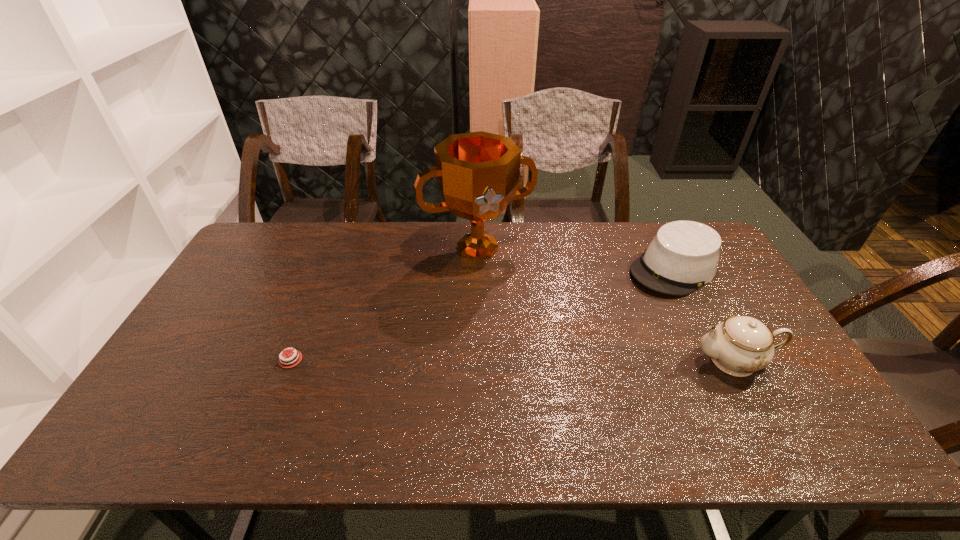
Image resolution: width=960 pixels, height=540 pixels. In order to click on free location that satisfies the following two spatial constraints: 1. on the front side of the award; 2. at the spout of the chinaware in this screenshot , I will do `click(477, 361)`.

Find the location of a particular element. vacant region that satisfies the following two spatial constraints: 1. on the back side of the leftmost object; 2. on the left side of the hat is located at coordinates (327, 269).